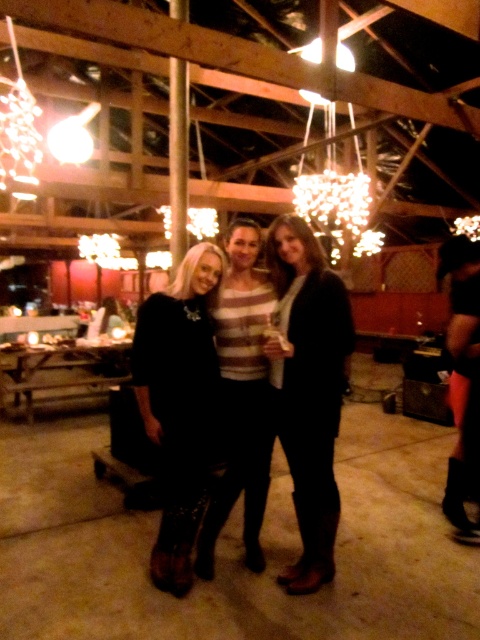
You are a photographer at the event and want to capture a clear photo of both the black leather pants at center and the striped sweater at center. Since both are at the center, which one might be more visible in the photo?

The black leather pants at center is in front of the striped sweater at center, so the black leather pants at center will be more visible in the photo.

You are a photographer at the event and want to ensure that both the black leather pants at center and the black leather dress at center are clearly visible in the photo. Since they are overlapping, which one should you adjust to avoid covering the other?

The black leather pants at center is in front of black leather dress at center, so you should adjust the position of the black leather pants at center to move it back to allow the black leather dress at center to be visible.